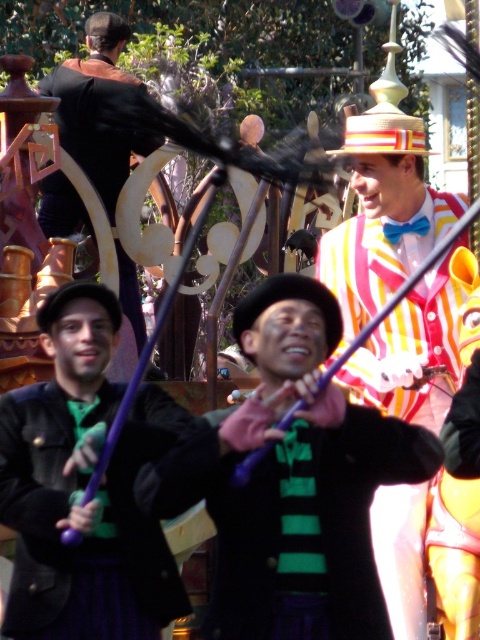
Question: Can you confirm if matte purple wand at center is wider than striped cotton suit at center?

Choices:
 (A) yes
 (B) no

Answer: (A)

Question: Does green striped scarf at center have a larger size compared to striped cotton suit at center?

Choices:
 (A) no
 (B) yes

Answer: (A)

Question: Which object is the closest to the striped cotton suit at center?

Choices:
 (A) matte purple wand at center
 (B) green striped scarf at center

Answer: (B)

Question: Which object is the closest to the striped cotton suit at center?

Choices:
 (A) green striped scarf at center
 (B) matte purple wand at center

Answer: (A)

Question: Estimate the real-world distances between objects in this image. Which object is closer to the matte purple wand at center?

Choices:
 (A) green striped scarf at center
 (B) striped cotton suit at center

Answer: (A)

Question: Is green striped scarf at center in front of striped cotton suit at center?

Choices:
 (A) yes
 (B) no

Answer: (A)